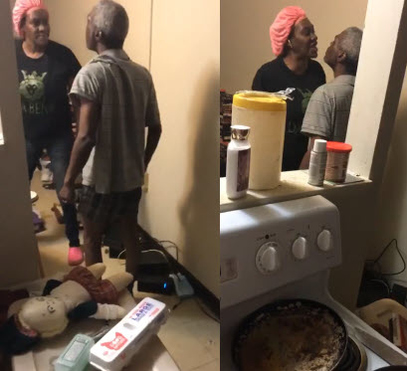
Find the location of a particular element. Image resolution: width=407 pixels, height=371 pixels. stove is located at coordinates (236, 232), (316, 211), (372, 342).